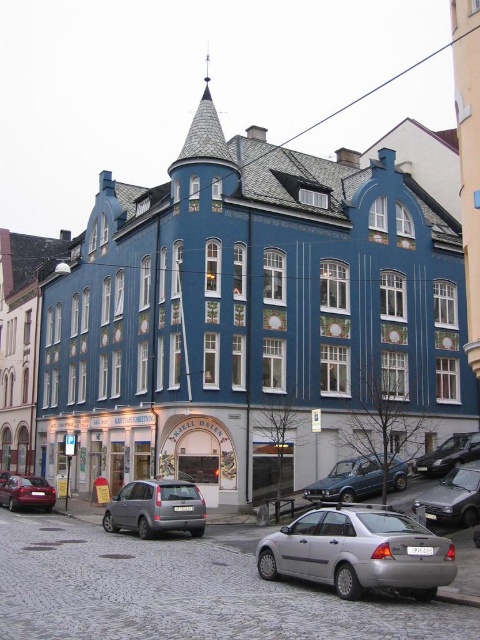
Does blue metallic sedan at center have a lesser width compared to shiny red sedan at lower left?

No.

This screenshot has height=640, width=480. Describe the element at coordinates (348, 481) in the screenshot. I see `blue metallic sedan at center` at that location.

What do you see at coordinates (348, 481) in the screenshot? I see `blue metallic sedan at center` at bounding box center [348, 481].

Locate an element on the screen. blue metallic sedan at center is located at coordinates (348, 481).

Can you confirm if blue metallic sedan at center is thinner than shiny black sedan at lower right?

No, blue metallic sedan at center is not thinner than shiny black sedan at lower right.

Can you confirm if blue metallic sedan at center is positioned to the right of shiny black sedan at lower right?

In fact, blue metallic sedan at center is to the left of shiny black sedan at lower right.

Between point (389, 461) and point (448, 445), which one is positioned in front?

Point (389, 461) is in front.

Where is `blue metallic sedan at center`? blue metallic sedan at center is located at coordinates (348, 481).

Who is lower down, matte blue building at left or silver metallic sedan at lower right?

silver metallic sedan at lower right is lower down.

Can you confirm if matte blue building at left is positioned above silver metallic sedan at lower right?

Yes, matte blue building at left is above silver metallic sedan at lower right.

Who is more forward, (8,237) or (422,500)?

Point (422,500)

Where is `matte blue building at left`? matte blue building at left is located at coordinates (22, 339).